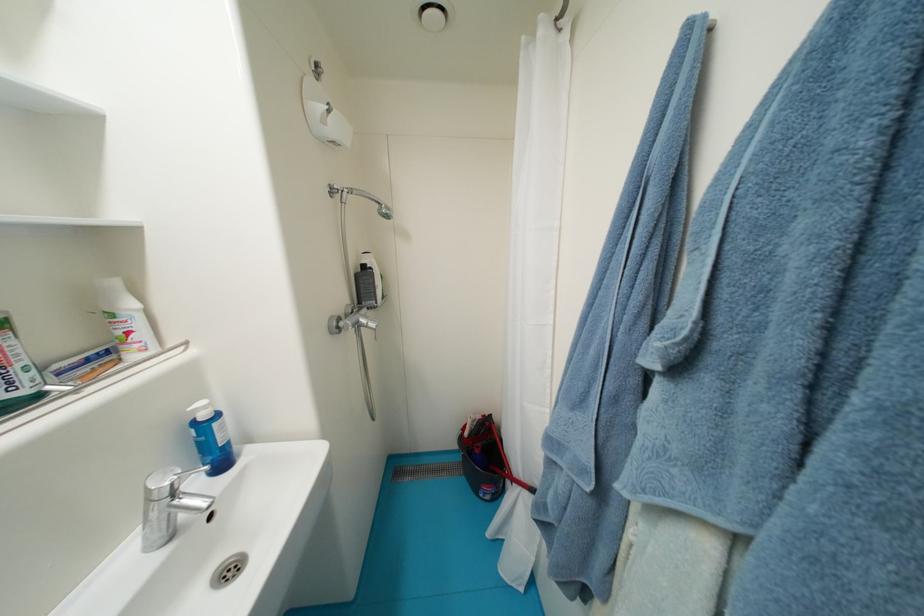
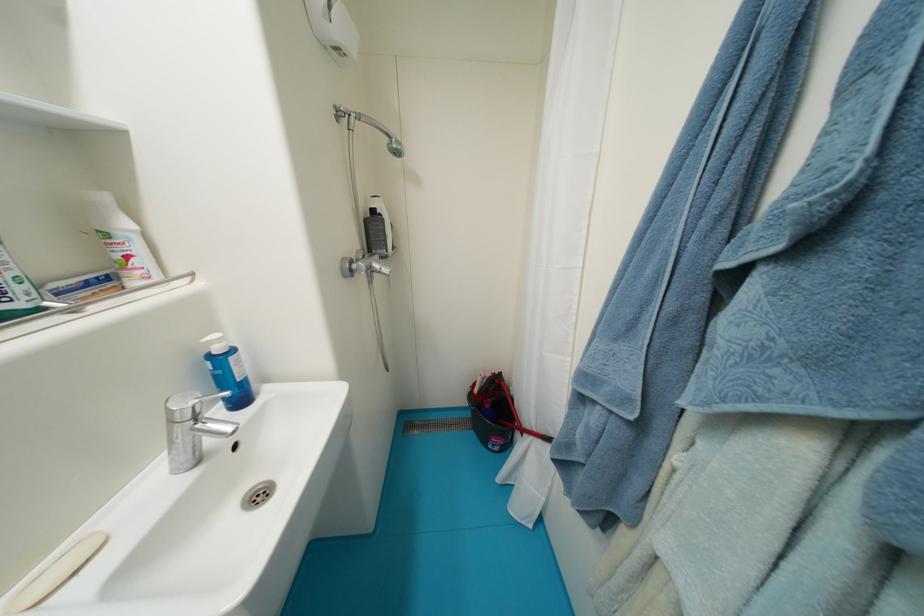
Which direction would the cameraman need to move to produce the second image?

The cameraman walked toward left, forward.